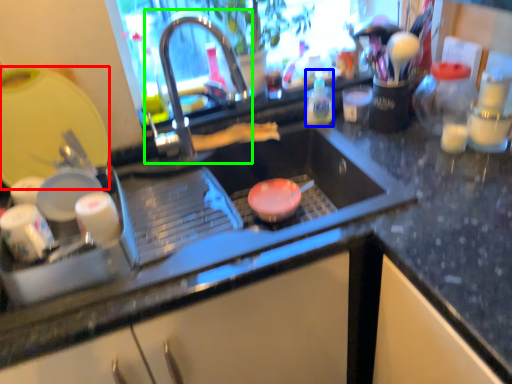
Question: Which object is the farthest from appliance (highlighted by a red box)? Choose among these: bottle (highlighted by a blue box) or tap (highlighted by a green box).

Choices:
 (A) bottle
 (B) tap

Answer: (A)